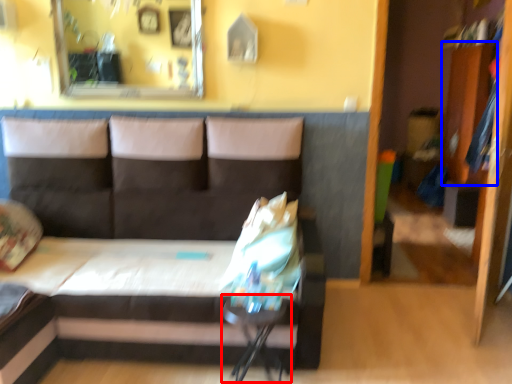
Question: Which object appears closest to the camera in this image, table (highlighted by a red box) or dresser (highlighted by a blue box)?

Choices:
 (A) table
 (B) dresser

Answer: (A)